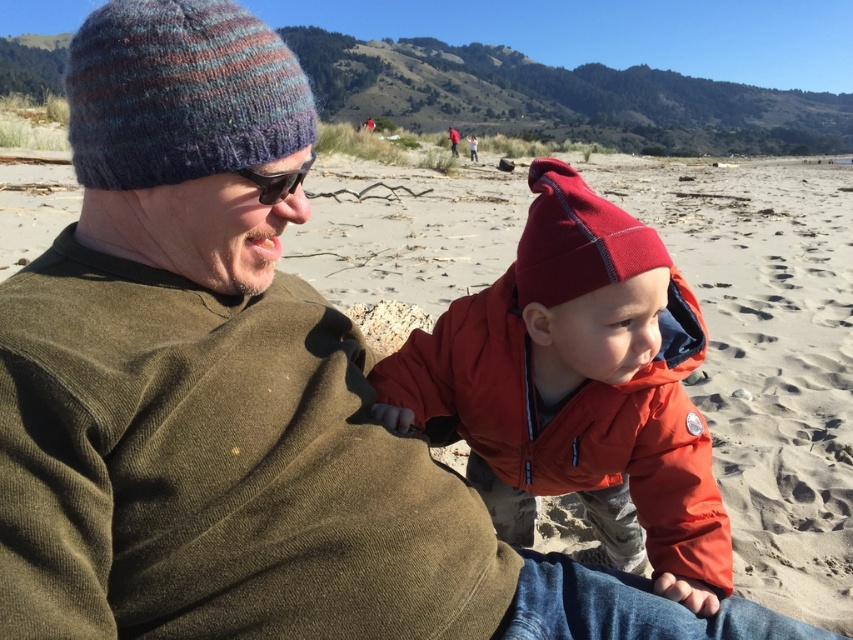
Question: Does matte orange jacket at center have a lesser width compared to multicolored knitted beanie at upper left?

Choices:
 (A) no
 (B) yes

Answer: (A)

Question: Which point is closer to the camera?

Choices:
 (A) (590, 285)
 (B) (129, 19)

Answer: (B)

Question: Is matte orange jacket at center above multicolored knitted beanie at upper left?

Choices:
 (A) yes
 (B) no

Answer: (B)

Question: Which point is closer to the camera?

Choices:
 (A) matte red knit beanie at center
 (B) multicolored knitted beanie at upper left

Answer: (B)

Question: Does matte orange jacket at center appear on the right side of matte red knit beanie at center?

Choices:
 (A) no
 (B) yes

Answer: (B)

Question: Which of the following is the farthest from the observer?

Choices:
 (A) multicolored knitted beanie at upper left
 (B) matte orange jacket at center
 (C) matte red knit beanie at center

Answer: (C)